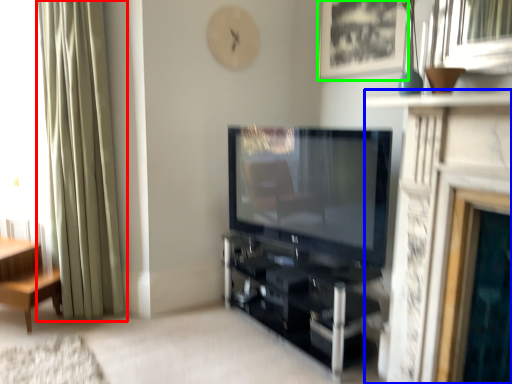
Question: Estimate the real-world distances between objects in this image. Which object is farther from curtain (highlighted by a red box), fireplace (highlighted by a blue box) or picture frame (highlighted by a green box)?

Choices:
 (A) fireplace
 (B) picture frame

Answer: (A)